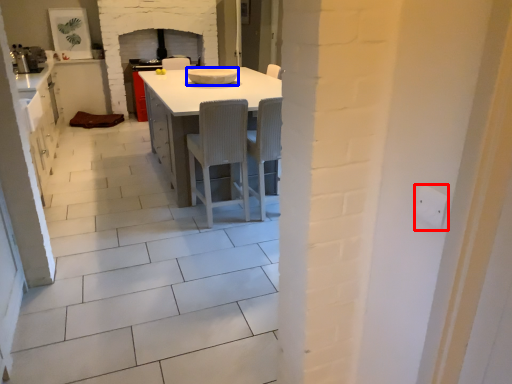
Question: Which object is closer to the camera taking this photo, electric outlet (highlighted by a red box) or appliance (highlighted by a blue box)?

Choices:
 (A) electric outlet
 (B) appliance

Answer: (A)